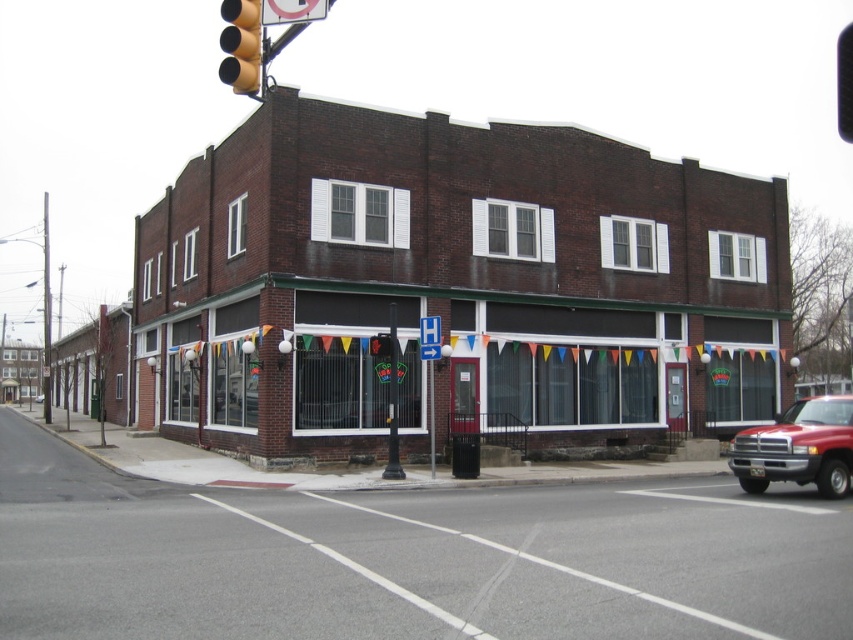
Question: Which object is the closest to the black metal traffic light at upper left?

Choices:
 (A) shiny red truck at lower right
 (B) smooth asphalt road at lower center
 (C) metallic pole at center
 (D) blue plastic sign at center

Answer: (B)

Question: Which object is the farthest from the red matte truck at center?

Choices:
 (A) shiny red truck at lower right
 (B) brick storefront at center
 (C) brown brick building at center

Answer: (A)

Question: Does shiny red truck at lower right appear over black metal pole at center?

Choices:
 (A) yes
 (B) no

Answer: (B)

Question: Is black metal pole at center further to the viewer compared to red matte truck at center?

Choices:
 (A) yes
 (B) no

Answer: (B)

Question: Which of the following is the farthest from the observer?

Choices:
 (A) (242, 554)
 (B) (432, 397)
 (C) (248, 42)
 (D) (36, 397)

Answer: (D)

Question: Is brick storefront at center behind black metal pole at center?

Choices:
 (A) yes
 (B) no

Answer: (A)